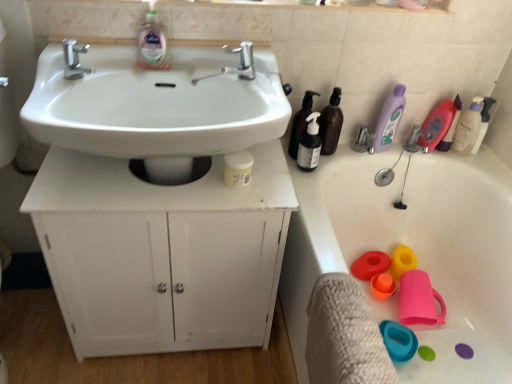
What are the coordinates of `unoccupied area in front of polished chrome tap at upper center, which ranks as the 1th tap in right-to-left order` in the screenshot? It's located at (261, 97).